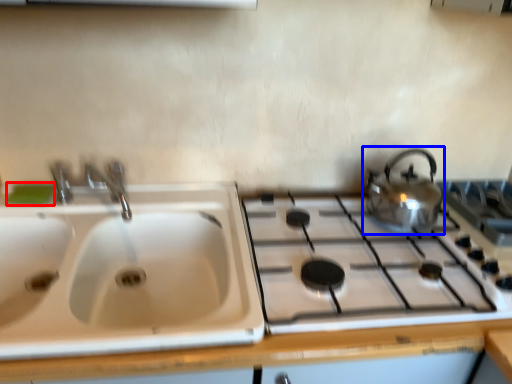
Question: Among these objects, which one is nearest to the camera, soap (highlighted by a red box) or kettle (highlighted by a blue box)?

Choices:
 (A) soap
 (B) kettle

Answer: (B)